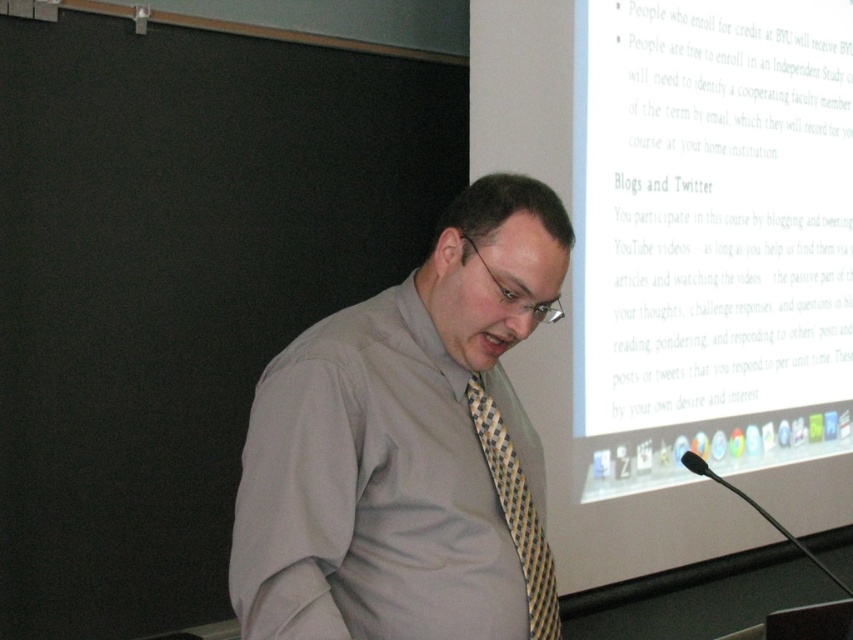
You are a photographer standing at a distance of 4 feet from the man in the image. You want to take a closeup shot of the gray fabric shirt at center without moving your position. Is the current distance sufficient to capture the shirt clearly in the frame?

The gray fabric shirt at center is 3.50 feet away from the camera. Since you are standing 4 feet away from the man, the distance is sufficient to capture the shirt clearly in the frame as it is within the photographer reach.

You are a fashion designer analyzing clothing layers in a presentation scene. The man is wearing a gray fabric shirt at center and a yellow and black woven tie at center. Which clothing item is closer to the viewer?

The gray fabric shirt at center is positioned over the yellow and black woven tie at center, so the gray fabric shirt at center is closer to the viewer.